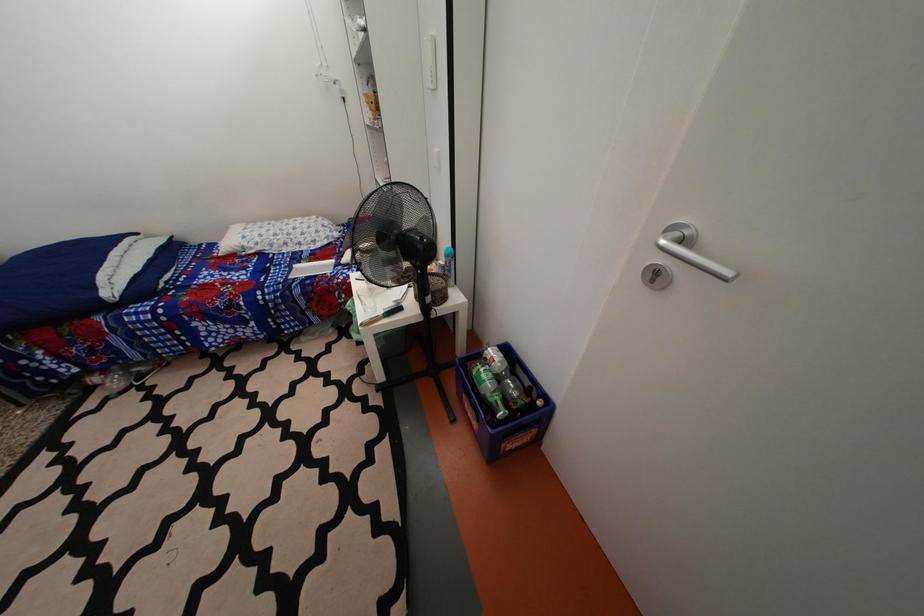
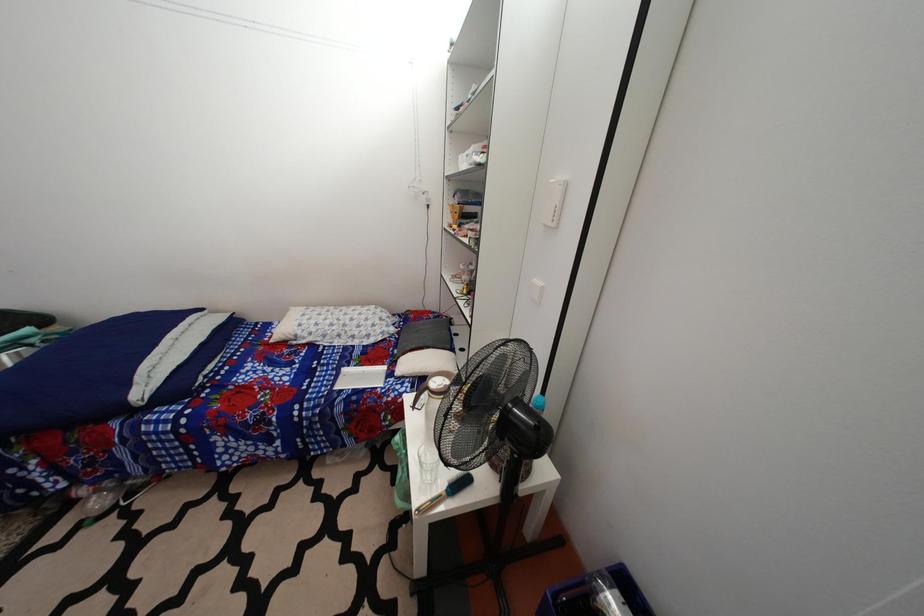
Question: How did the camera likely rotate?

Choices:
 (A) Left
 (B) Right
 (C) Up
 (D) Down

Answer: (C)